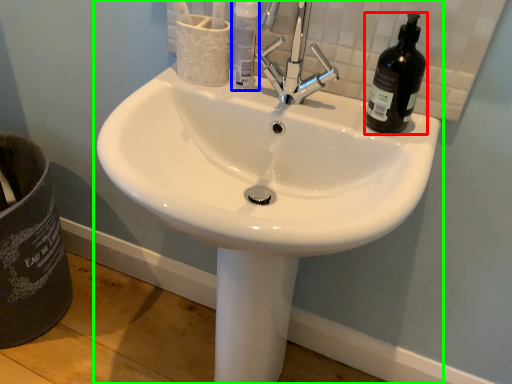
Question: Considering the real-world distances, which object is farthest from beer bottle (highlighted by a red box)? bottle (highlighted by a blue box) or sink (highlighted by a green box)?

Choices:
 (A) bottle
 (B) sink

Answer: (B)